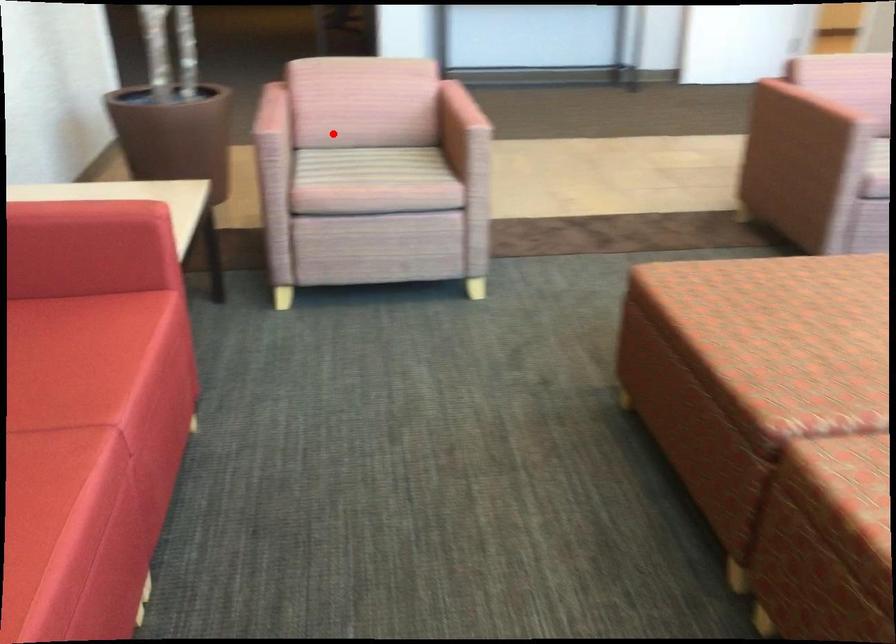
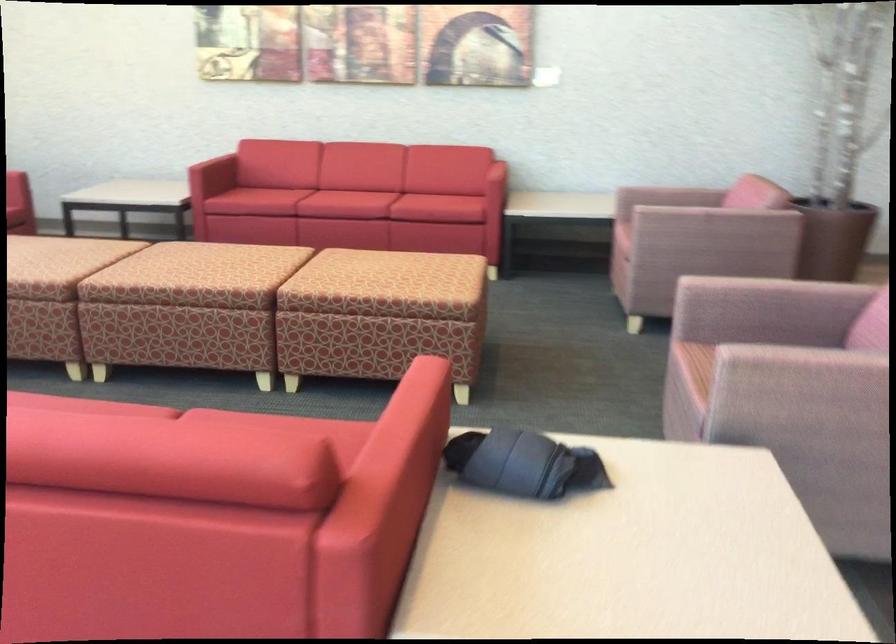
Where in the second image is the point corresponding to the highlighted location from the first image?

(669, 196)